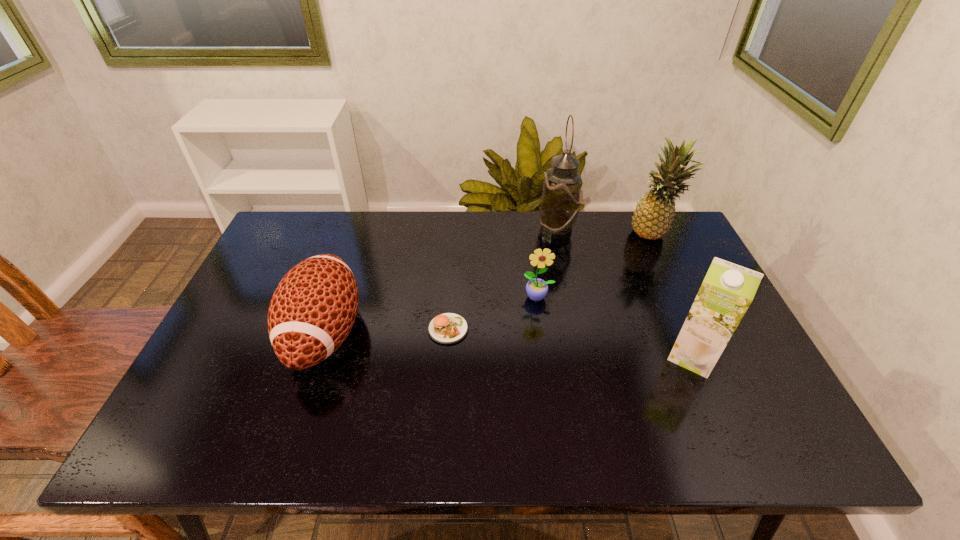
Find the location of a particular element. The width and height of the screenshot is (960, 540). oil lamp is located at coordinates (560, 201).

The image size is (960, 540). In order to click on pineapple in this screenshot , I will do `click(652, 218)`.

Where is `soya milk`? soya milk is located at coordinates (728, 289).

Find the location of a particular element. This screenshot has height=540, width=960. the leftmost object is located at coordinates (313, 309).

Find the location of a particular element. The image size is (960, 540). sunflower is located at coordinates (536, 288).

What are the coordinates of `the fifth object from right to left` in the screenshot? It's located at (447, 328).

I want to click on patty, so click(447, 328).

Find the location of a particular element. free point located on the left of the oil lamp is located at coordinates (423, 230).

The image size is (960, 540). In order to click on blank area located on the left of the pineapple in this screenshot , I will do `click(511, 234)`.

Find the location of `vacant space located 0.160m on the left of the soya milk`. vacant space located 0.160m on the left of the soya milk is located at coordinates (601, 356).